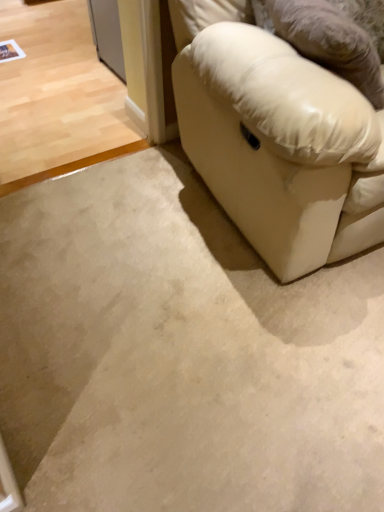
Question: In terms of width, does leather-like beige pillow at right look wider or thinner when compared to white leather couch at lower right?

Choices:
 (A) wide
 (B) thin

Answer: (B)

Question: From the image's perspective, is leather-like beige pillow at right above or below white leather couch at lower right?

Choices:
 (A) below
 (B) above

Answer: (A)

Question: Which object is the closest to the beige carpet at lower left, which is the second concrete in bottom-to-top order?

Choices:
 (A) leather-like beige pillow at right
 (B) beige carpet at lower right, positioned as the first concrete in front-to-back order
 (C) white leather couch at lower right

Answer: (C)

Question: Estimate the real-world distances between objects in this image. Which object is closer to the leather-like beige pillow at right?

Choices:
 (A) white leather couch at lower right
 (B) beige carpet at lower right, positioned as the second concrete in back-to-front order
 (C) beige carpet at lower left, which is the first concrete from back to front

Answer: (A)